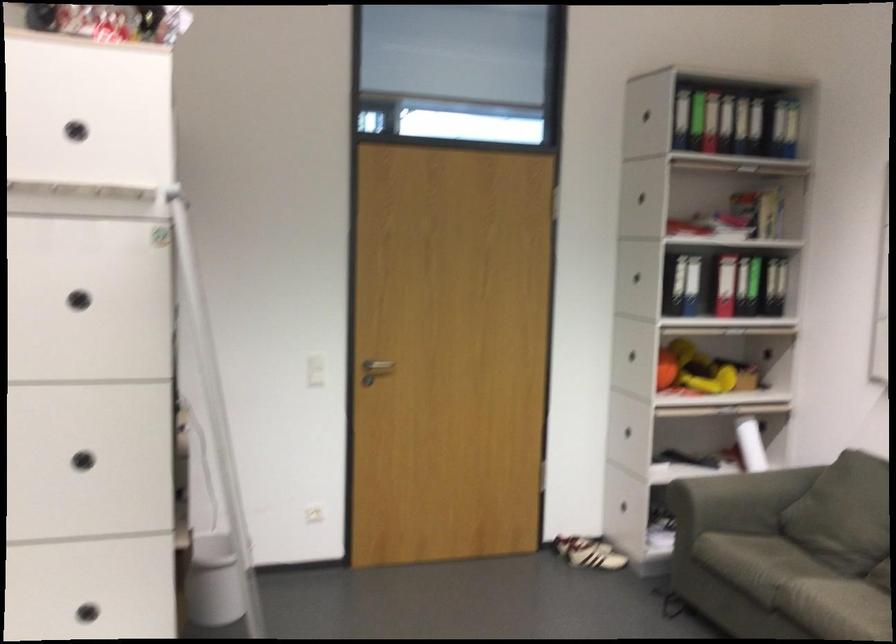
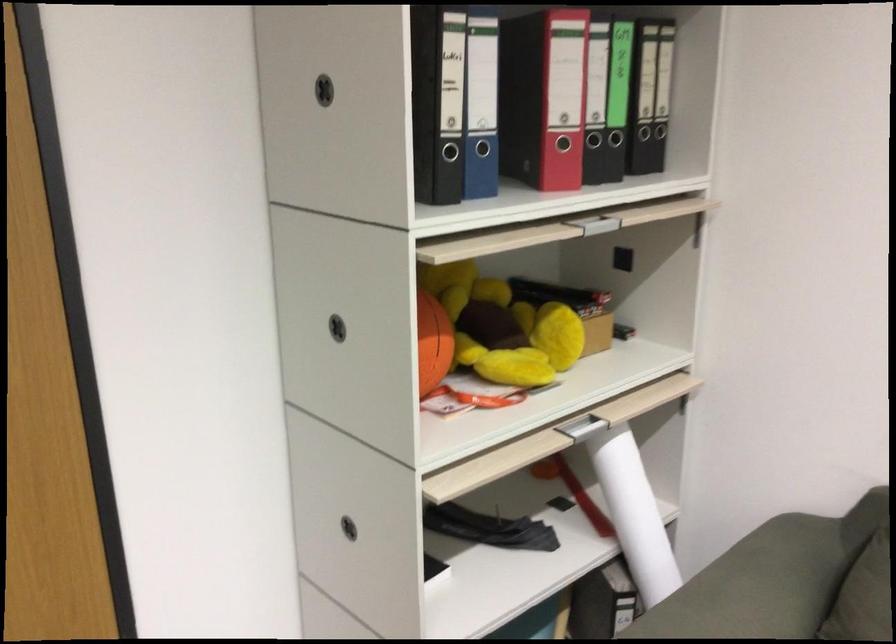
Locate, in the second image, the point that corresponds to pixel 659 357 in the first image.

(433, 343)